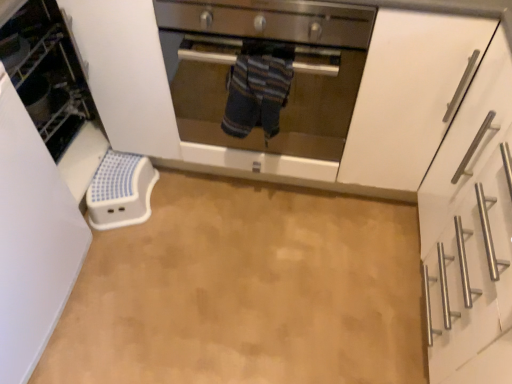
Question: Would you say white plastic step stool at left is to the left or to the right of striped fabric towel at center in the picture?

Choices:
 (A) left
 (B) right

Answer: (A)

Question: In terms of height, does white plastic step stool at left look taller or shorter compared to striped fabric towel at center?

Choices:
 (A) tall
 (B) short

Answer: (A)

Question: Considering the real-world distances, which object is closest to the white matte cabinet at right?

Choices:
 (A) beige vinyl floor at center
 (B) white plastic step stool at left
 (C) striped fabric towel at center
 (D) stainless steel oven at center

Answer: (D)

Question: Estimate the real-world distances between objects in this image. Which object is closer to the white matte cabinet at right?

Choices:
 (A) striped fabric towel at center
 (B) beige vinyl floor at center
 (C) stainless steel oven at center
 (D) white plastic step stool at left

Answer: (C)